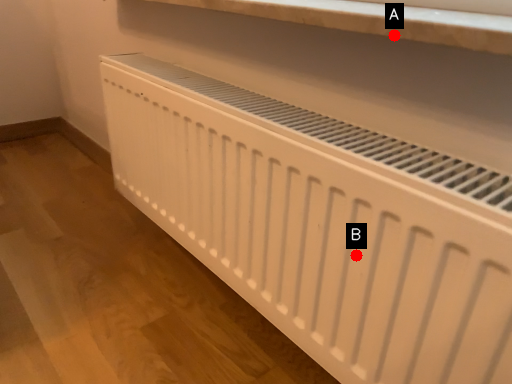
Question: Two points are circled on the image, labeled by A and B beside each circle. Which point is further to the camera?

Choices:
 (A) A is further
 (B) B is further

Answer: (B)